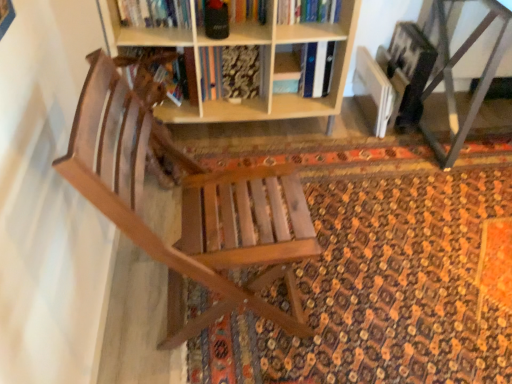
Question: Does hardcover book at upper center have a larger size compared to metallic gray table at lower right?

Choices:
 (A) no
 (B) yes

Answer: (A)

Question: Is hardcover book at upper center facing towards metallic gray table at lower right?

Choices:
 (A) no
 (B) yes

Answer: (A)

Question: Is the depth of hardcover book at upper center greater than that of metallic gray table at lower right?

Choices:
 (A) no
 (B) yes

Answer: (B)

Question: Is metallic gray table at lower right at the back of hardcover book at upper center?

Choices:
 (A) no
 (B) yes

Answer: (A)

Question: Does hardcover book at upper center have a greater width compared to metallic gray table at lower right?

Choices:
 (A) no
 (B) yes

Answer: (A)

Question: Considering the positions of point (116, 31) and point (292, 21), is point (116, 31) closer or farther from the camera than point (292, 21)?

Choices:
 (A) farther
 (B) closer

Answer: (B)

Question: From a real-world perspective, is wooden bookshelf at upper center physically located above or below hardcover book at upper center?

Choices:
 (A) above
 (B) below

Answer: (B)

Question: Is wooden bookshelf at upper center bigger or smaller than hardcover book at upper center?

Choices:
 (A) big
 (B) small

Answer: (A)

Question: Is wooden bookshelf at upper center inside the boundaries of hardcover book at upper center, or outside?

Choices:
 (A) outside
 (B) inside

Answer: (A)

Question: From the image's perspective, is hardcover book at upper center located above or below patterned carpet at center?

Choices:
 (A) above
 (B) below

Answer: (A)

Question: In terms of height, does hardcover book at upper center look taller or shorter compared to patterned carpet at center?

Choices:
 (A) tall
 (B) short

Answer: (A)

Question: In terms of width, does hardcover book at upper center look wider or thinner when compared to patterned carpet at center?

Choices:
 (A) thin
 (B) wide

Answer: (A)

Question: In the image, is hardcover book at upper center positioned in front of or behind patterned carpet at center?

Choices:
 (A) front
 (B) behind

Answer: (B)

Question: Considering the positions of patterned carpet at center and metallic gray table at lower right in the image, is patterned carpet at center bigger or smaller than metallic gray table at lower right?

Choices:
 (A) big
 (B) small

Answer: (B)

Question: In terms of height, does patterned carpet at center look taller or shorter compared to metallic gray table at lower right?

Choices:
 (A) tall
 (B) short

Answer: (B)